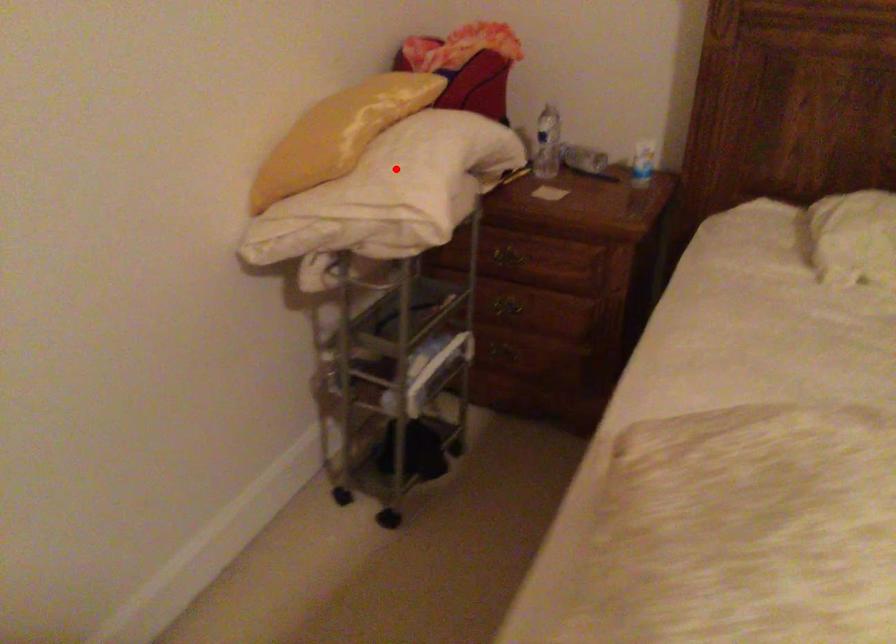
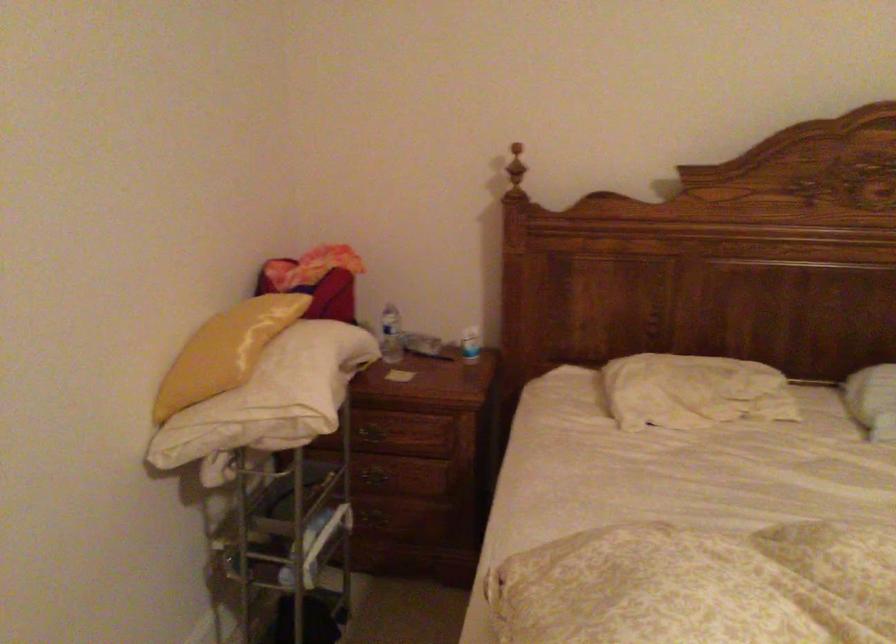
Question: I am providing you with two images of the same scene from different viewpoints. Given a red point in image1, look at the same physical point in image2. Is it:

Choices:
 (A) Closer to the viewpoint
 (B) Farther from the viewpoint

Answer: (B)